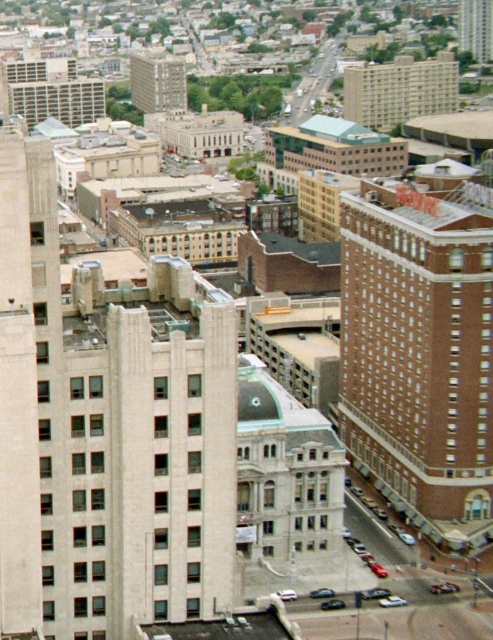
You are a drone operator tasked with capturing aerial footage of the urban area. Your drone has a maximum flight range of 60 meters. You need to fly from the beige brick building at upper center to the smooth glass skyscraper at upper right. Can your drone complete this flight without needing to return to its starting point?

The beige brick building at upper center is 65.70 meters away from the smooth glass skyscraper at upper right. Since the drone has a maximum flight range of 60 meters, it cannot complete the flight without needing to return to its starting point.

You are an urban planner analyzing the layout of this city block. You need to determine which of the two buildings, the beige brick building at center or the smooth glass skyscraper at upper right, has a greater horizontal span. Based on the aerial view provided, which building is wider?

The beige brick building at center has a greater width than the smooth glass skyscraper at upper right, so it is wider.

You are a drone operator flying over an urban area. You need to determine the order of two points from nearest to farthest from your current position. The points are point 1 at coordinates point [165,93] and point 2 at coordinates point [481,54]. Based on the scene, which point is closer to you?

Result: Point 1 at coordinates point [165,93] is closer to you because it is in front of point 2 at coordinates point [481,54] according to the scene description.